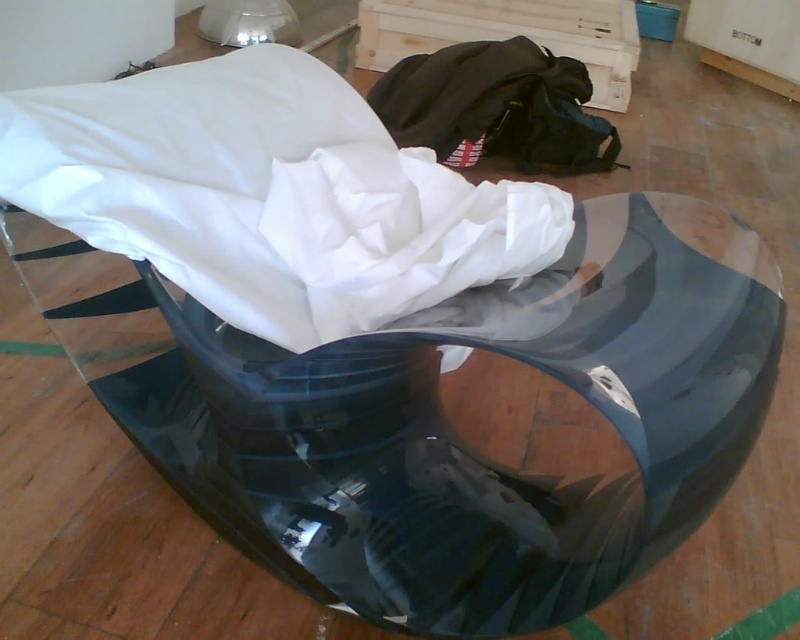
Does point (329, 328) lie in front of point (432, 90)?

Yes, it is.

Can you confirm if white fabric at center is smaller than black fabric bean bag at center?

No.

What do you see at coordinates (268, 195) in the screenshot?
I see `white fabric at center` at bounding box center [268, 195].

Identify the location of white fabric at center. (268, 195).

Who is positioned more to the right, transparent glossy glass table at center or white fabric at center?

white fabric at center

Which is above, transparent glossy glass table at center or white fabric at center?

white fabric at center is higher up.

Who is more distant from viewer, [450,323] or [160,124]?

Positioned behind is point [160,124].

I want to click on transparent glossy glass table at center, so click(449, 417).

Who is higher up, transparent glossy glass table at center or black fabric bean bag at center?

black fabric bean bag at center is higher up.

What do you see at coordinates (449, 417) in the screenshot? I see `transparent glossy glass table at center` at bounding box center [449, 417].

Who is more forward, (450, 461) or (506, 92)?

Point (450, 461) is more forward.

You are a GUI agent. You are given a task and a screenshot of the screen. Output one action in this format:
    pyautogui.click(x=<x>, y=<y>)
    Task: Click on the transparent glossy glass table at center
    
    Given the screenshot: What is the action you would take?
    pyautogui.click(x=449, y=417)